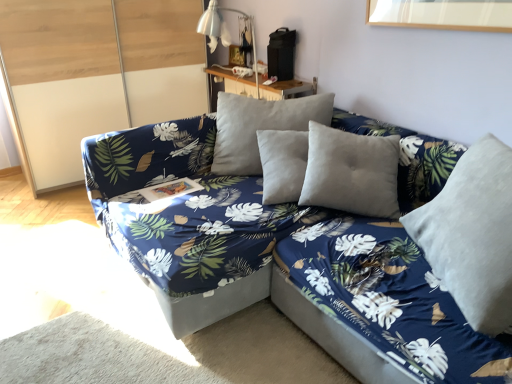
Question: Considering the relative positions of velvet gray pillow at right and transparent glass door at left in the image provided, is velvet gray pillow at right to the left of transparent glass door at left from the viewer's perspective?

Choices:
 (A) no
 (B) yes

Answer: (A)

Question: From the image's perspective, is velvet gray pillow at right above transparent glass door at left?

Choices:
 (A) yes
 (B) no

Answer: (B)

Question: Does velvet gray pillow at right have a lesser height compared to transparent glass door at left?

Choices:
 (A) yes
 (B) no

Answer: (A)

Question: Is the position of velvet gray pillow at right more distant than that of transparent glass door at left?

Choices:
 (A) no
 (B) yes

Answer: (A)

Question: Is velvet gray pillow at right in contact with transparent glass door at left?

Choices:
 (A) no
 (B) yes

Answer: (A)

Question: Considering the positions of transparent glass door at left and blue fabric couch at center in the image, is transparent glass door at left bigger or smaller than blue fabric couch at center?

Choices:
 (A) small
 (B) big

Answer: (B)

Question: In the image, is transparent glass door at left positioned in front of or behind blue fabric couch at center?

Choices:
 (A) front
 (B) behind

Answer: (B)

Question: From a real-world perspective, is transparent glass door at left above or below blue fabric couch at center?

Choices:
 (A) below
 (B) above

Answer: (B)

Question: Is transparent glass door at left taller or shorter than blue fabric couch at center?

Choices:
 (A) tall
 (B) short

Answer: (A)

Question: In terms of width, does blue fabric couch at center look wider or thinner when compared to transparent glass door at left?

Choices:
 (A) wide
 (B) thin

Answer: (A)

Question: Is blue fabric couch at center situated inside transparent glass door at left or outside?

Choices:
 (A) outside
 (B) inside

Answer: (A)

Question: Would you say blue fabric couch at center is to the left or to the right of transparent glass door at left in the picture?

Choices:
 (A) right
 (B) left

Answer: (A)

Question: Looking at the image, does blue fabric couch at center seem bigger or smaller compared to transparent glass door at left?

Choices:
 (A) big
 (B) small

Answer: (B)

Question: Would you say wooden table at upper center is to the left or to the right of velvet blue bed frame at center in the picture?

Choices:
 (A) right
 (B) left

Answer: (B)

Question: Looking at the image, does wooden table at upper center seem bigger or smaller compared to velvet blue bed frame at center?

Choices:
 (A) small
 (B) big

Answer: (A)